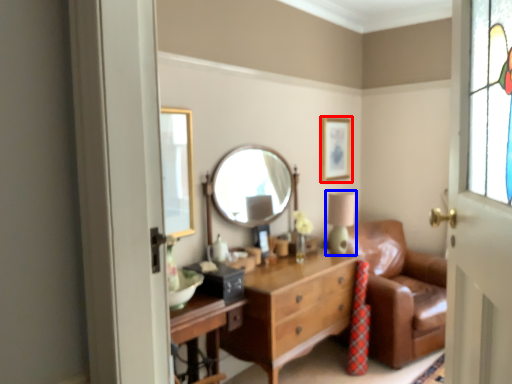
Question: Which of the following is the closest to the observer, picture frame (highlighted by a red box) or table lamp (highlighted by a blue box)?

Choices:
 (A) picture frame
 (B) table lamp

Answer: (B)